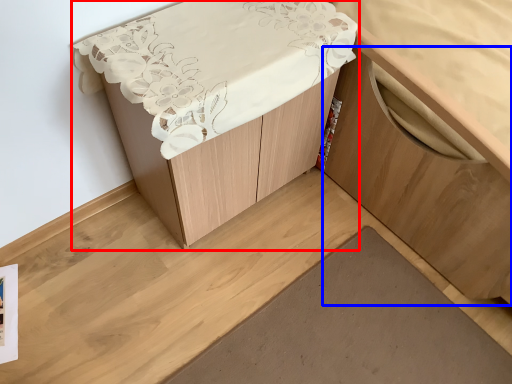
Question: Which object appears closest to the camera in this image, furniture (highlighted by a red box) or cabinetry (highlighted by a blue box)?

Choices:
 (A) furniture
 (B) cabinetry

Answer: (B)